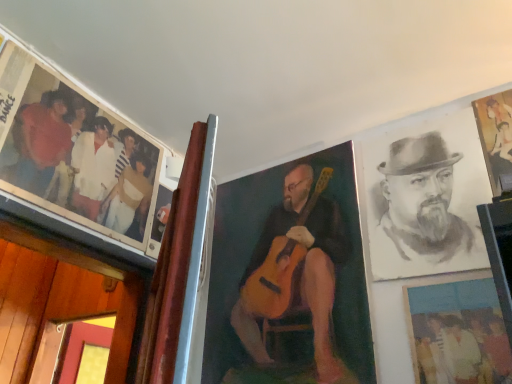
Identify the location of charcoal portrait of man at right. The height and width of the screenshot is (384, 512). (423, 212).

This screenshot has height=384, width=512. What do you see at coordinates (457, 332) in the screenshot?
I see `matte plastic photo at lower right, which is counted as the 2th picture frame, starting from the right` at bounding box center [457, 332].

Where is `matte plastic photo at lower right, which is counted as the 2th picture frame, starting from the right`? matte plastic photo at lower right, which is counted as the 2th picture frame, starting from the right is located at coordinates (457, 332).

Locate an element on the screen. The image size is (512, 384). matte black photo at upper left is located at coordinates (81, 162).

Where is `man in front of the wooden frame at center, the first picture frame in the left-to-right sequence`? The image size is (512, 384). man in front of the wooden frame at center, the first picture frame in the left-to-right sequence is located at coordinates (423, 212).

Would you say wooden frame at center, the first picture frame in the left-to-right sequence, is inside or outside charcoal portrait of man at right?

wooden frame at center, the first picture frame in the left-to-right sequence, is not inside charcoal portrait of man at right, it's outside.

Visually, is wooden frame at center, the first picture frame in the left-to-right sequence, positioned to the left or to the right of charcoal portrait of man at right?

wooden frame at center, the first picture frame in the left-to-right sequence, is positioned on charcoal portrait of man at right's left side.

Is wooden frame at center, which is counted as the 3th picture frame, starting from the right, looking in the opposite direction of charcoal portrait of man at right?

No, wooden frame at center, which is counted as the 3th picture frame, starting from the right,'s orientation is not away from charcoal portrait of man at right.

Considering the positions of objects matte black photo at upper left and matte plastic photo at lower right, which is counted as the 2th picture frame, starting from the right, in the image provided, who is more to the right, matte black photo at upper left or matte plastic photo at lower right, which is counted as the 2th picture frame, starting from the right,?

Positioned to the right is matte plastic photo at lower right, which is counted as the 2th picture frame, starting from the right.

Considering the sizes of objects matte black photo at upper left and matte plastic photo at lower right, which is counted as the 2th picture frame, starting from the right, in the image provided, who is shorter, matte black photo at upper left or matte plastic photo at lower right, which is counted as the 2th picture frame, starting from the right,?

matte black photo at upper left is shorter.

From the image's perspective, which is above, matte black photo at upper left or matte plastic photo at lower right, which is counted as the 2th picture frame, starting from the right?

matte black photo at upper left is shown above in the image.

Who is shorter, charcoal portrait of man at right or gold metallic painting at upper right, which is the third picture frame from left to right?

gold metallic painting at upper right, which is the third picture frame from left to right, is shorter.

From a real-world perspective, relative to gold metallic painting at upper right, positioned as the 1th picture frame in right-to-left order, is charcoal portrait of man at right vertically above or below?

charcoal portrait of man at right is below gold metallic painting at upper right, positioned as the 1th picture frame in right-to-left order.

Between charcoal portrait of man at right and gold metallic painting at upper right, which is the third picture frame from left to right, which one has smaller size?

With smaller size is gold metallic painting at upper right, which is the third picture frame from left to right.

Considering the sizes of gold metallic painting at upper right, positioned as the 1th picture frame in right-to-left order, and wooden frame at center, the first picture frame in the left-to-right sequence, in the image, is gold metallic painting at upper right, positioned as the 1th picture frame in right-to-left order, taller or shorter than wooden frame at center, the first picture frame in the left-to-right sequence,?

In the image, gold metallic painting at upper right, positioned as the 1th picture frame in right-to-left order, appears to be shorter than wooden frame at center, the first picture frame in the left-to-right sequence.

Locate an element on the screen. The width and height of the screenshot is (512, 384). the 1st picture frame below the gold metallic painting at upper right, which is the third picture frame from left to right (from the image's perspective) is located at coordinates (289, 278).

Can you confirm if gold metallic painting at upper right, which is the third picture frame from left to right, is smaller than wooden frame at center, which is counted as the 3th picture frame, starting from the right?

Correct, gold metallic painting at upper right, which is the third picture frame from left to right, occupies less space than wooden frame at center, which is counted as the 3th picture frame, starting from the right.

Is gold metallic painting at upper right, which is the third picture frame from left to right, to the left of wooden frame at center, which is counted as the 3th picture frame, starting from the right, from the viewer's perspective?

In fact, gold metallic painting at upper right, which is the third picture frame from left to right, is to the right of wooden frame at center, which is counted as the 3th picture frame, starting from the right.

From a real-world perspective, which is physically above, matte black photo at upper left or wooden frame at center, the first picture frame in the left-to-right sequence?

In real-world perspective, matte black photo at upper left is above.

From the image's perspective, who appears lower, matte black photo at upper left or wooden frame at center, which is counted as the 3th picture frame, starting from the right?

wooden frame at center, which is counted as the 3th picture frame, starting from the right.

Does matte black photo at upper left have a lesser height compared to wooden frame at center, the first picture frame in the left-to-right sequence?

Correct, matte black photo at upper left is not as tall as wooden frame at center, the first picture frame in the left-to-right sequence.

Is matte black photo at upper left completely or partially outside of charcoal portrait of man at right?

Indeed, matte black photo at upper left is completely outside charcoal portrait of man at right.

Considering the sizes of matte black photo at upper left and charcoal portrait of man at right in the image, is matte black photo at upper left taller or shorter than charcoal portrait of man at right?

matte black photo at upper left is shorter than charcoal portrait of man at right.

Are matte black photo at upper left and charcoal portrait of man at right located far from each other?

They are positioned close to each other.

Does point (79, 130) lie behind point (417, 233)?

That is True.

From the image's perspective, is matte plastic photo at lower right, which is counted as the 2th picture frame, starting from the right, over wooden frame at center, which is counted as the 3th picture frame, starting from the right?

No, from the image's perspective, matte plastic photo at lower right, which is counted as the 2th picture frame, starting from the right, is not over wooden frame at center, which is counted as the 3th picture frame, starting from the right.

In the scene shown: Measure the distance between matte plastic photo at lower right, acting as the second picture frame starting from the left, and wooden frame at center, which is counted as the 3th picture frame, starting from the right.

The distance of matte plastic photo at lower right, acting as the second picture frame starting from the left, from wooden frame at center, which is counted as the 3th picture frame, starting from the right, is 14.31 inches.

Looking at this image, can you confirm if matte plastic photo at lower right, which is counted as the 2th picture frame, starting from the right, is positioned to the right of wooden frame at center, which is counted as the 3th picture frame, starting from the right?

Yes, matte plastic photo at lower right, which is counted as the 2th picture frame, starting from the right, is to the right of wooden frame at center, which is counted as the 3th picture frame, starting from the right.

Is matte plastic photo at lower right, acting as the second picture frame starting from the left, bigger or smaller than wooden frame at center, which is counted as the 3th picture frame, starting from the right?

Considering their sizes, matte plastic photo at lower right, acting as the second picture frame starting from the left, takes up less space than wooden frame at center, which is counted as the 3th picture frame, starting from the right.

I want to click on the 1st picture frame located beneath the charcoal portrait of man at right (from a real-world perspective), so click(289, 278).

From the image's perspective, starting from the matte black photo at upper left, which picture frame is the 2nd one below? Please provide its 2D coordinates.

[(457, 332)]

Estimate the real-world distances between objects in this image. Which object is closer to charcoal portrait of man at right, matte plastic photo at lower right, acting as the second picture frame starting from the left, or wooden frame at center, which is counted as the 3th picture frame, starting from the right?

matte plastic photo at lower right, acting as the second picture frame starting from the left, lies closer to charcoal portrait of man at right than the other object.

Which object lies further to the anchor point gold metallic painting at upper right, which is the third picture frame from left to right, matte plastic photo at lower right, acting as the second picture frame starting from the left, or matte black photo at upper left?

Among the two, matte black photo at upper left is located further to gold metallic painting at upper right, which is the third picture frame from left to right.

When comparing their distances from matte plastic photo at lower right, which is counted as the 2th picture frame, starting from the right, does charcoal portrait of man at right or wooden frame at center, the first picture frame in the left-to-right sequence, seem closer?

The object closer to matte plastic photo at lower right, which is counted as the 2th picture frame, starting from the right, is charcoal portrait of man at right.

From the picture: Considering their positions, is matte black photo at upper left positioned further to gold metallic painting at upper right, positioned as the 1th picture frame in right-to-left order, than charcoal portrait of man at right?

Based on the image, matte black photo at upper left appears to be further to gold metallic painting at upper right, positioned as the 1th picture frame in right-to-left order.

Which object lies further to the anchor point charcoal portrait of man at right, wooden frame at center, the first picture frame in the left-to-right sequence, or matte plastic photo at lower right, acting as the second picture frame starting from the left?

The object further to charcoal portrait of man at right is wooden frame at center, the first picture frame in the left-to-right sequence.

When comparing their distances from gold metallic painting at upper right, positioned as the 1th picture frame in right-to-left order, does charcoal portrait of man at right or matte plastic photo at lower right, acting as the second picture frame starting from the left, seem closer?

charcoal portrait of man at right lies closer to gold metallic painting at upper right, positioned as the 1th picture frame in right-to-left order, than the other object.

Considering their positions, is charcoal portrait of man at right positioned closer to matte black photo at upper left than matte plastic photo at lower right, acting as the second picture frame starting from the left?

Among the two, charcoal portrait of man at right is located nearer to matte black photo at upper left.

Looking at the image, which one is located closer to charcoal portrait of man at right, gold metallic painting at upper right, positioned as the 1th picture frame in right-to-left order, or matte plastic photo at lower right, which is counted as the 2th picture frame, starting from the right?

gold metallic painting at upper right, positioned as the 1th picture frame in right-to-left order, lies closer to charcoal portrait of man at right than the other object.

Identify the location of picture frame situated between matte black photo at upper left and charcoal portrait of man at right from left to right. (289, 278).

Locate an element on the screen. man between matte black photo at upper left and gold metallic painting at upper right, positioned as the 1th picture frame in right-to-left order, from left to right is located at coordinates (423, 212).

Where is `man that lies between gold metallic painting at upper right, positioned as the 1th picture frame in right-to-left order, and matte plastic photo at lower right, acting as the second picture frame starting from the left, from top to bottom`? The height and width of the screenshot is (384, 512). man that lies between gold metallic painting at upper right, positioned as the 1th picture frame in right-to-left order, and matte plastic photo at lower right, acting as the second picture frame starting from the left, from top to bottom is located at coordinates (423, 212).

What are the coordinates of `picture frame located between matte black photo at upper left and matte plastic photo at lower right, acting as the second picture frame starting from the left, in the left-right direction` in the screenshot? It's located at (289, 278).